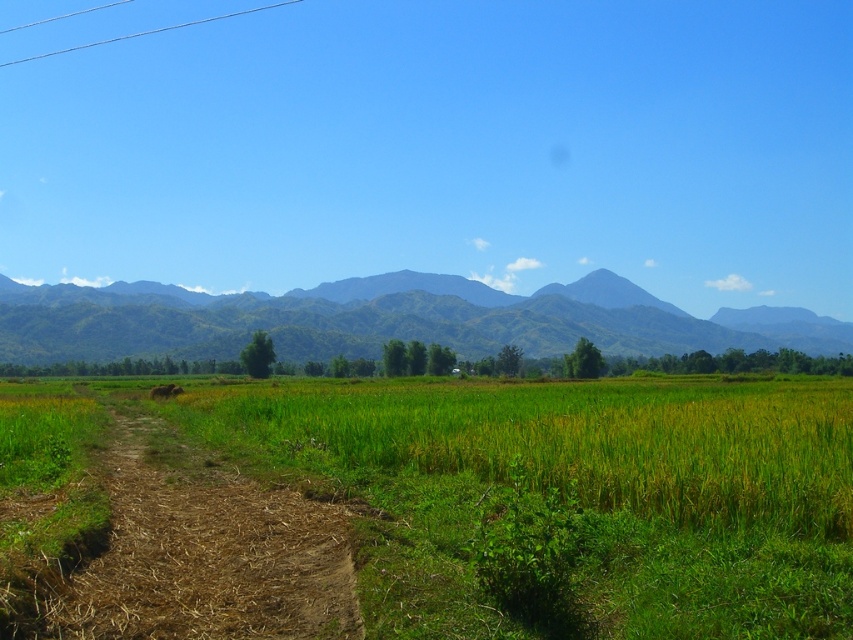
You are a farmer planning to plant crops in the green grassy field at center and the brown dirt track at lower left. Which area has a larger width for planting?

The green grassy field at center has a larger width than the brown dirt track at lower left, so it can accommodate more crops.

Based on the photo, you are standing at the starting point of the brown dirt track at lower left and want to reach the green grassy field at center. Which direction should you head towards?

You should head towards the right direction to reach the green grassy field at center since it is located to the right of the brown dirt track at lower left.